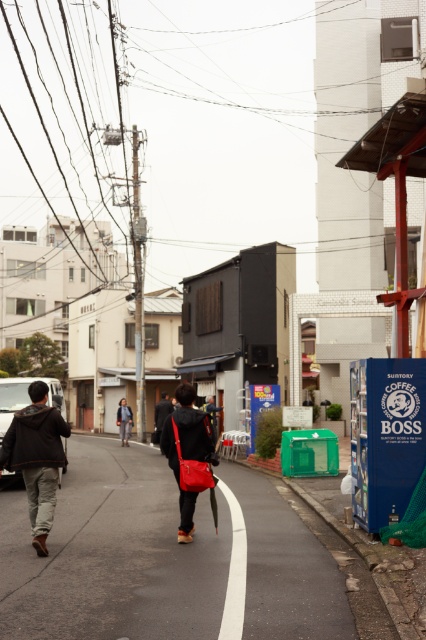
Question: Is black asphalt pavement at center positioned in front of denim jacket at center?

Choices:
 (A) no
 (B) yes

Answer: (B)

Question: Is black asphalt pavement at center smaller than denim jacket at center?

Choices:
 (A) yes
 (B) no

Answer: (B)

Question: Is black asphalt pavement at center to the right of denim jacket at center from the viewer's perspective?

Choices:
 (A) yes
 (B) no

Answer: (A)

Question: Among these objects, which one is nearest to the camera?

Choices:
 (A) matte red bag at center
 (B) dark gray hoodie at center
 (C) dark brown leather jacket at center
 (D) black asphalt pavement at center

Answer: (D)

Question: Which object appears closest to the camera in this image?

Choices:
 (A) denim jacket at center
 (B) black asphalt pavement at center

Answer: (B)

Question: Which point appears farthest from the camera in this image?

Choices:
 (A) (184, 465)
 (B) (152, 436)
 (C) (294, 636)
 (D) (123, 416)

Answer: (D)